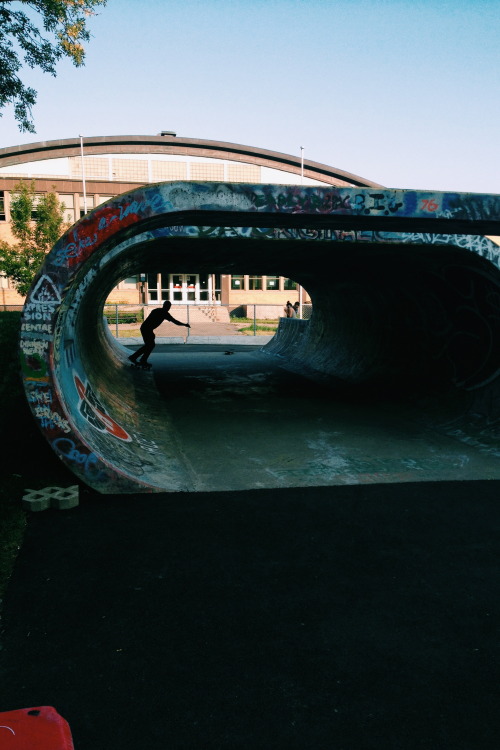
Locate an element on the screen. stair is located at coordinates (179, 306), (179, 310), (180, 316), (203, 316), (203, 310), (200, 306).